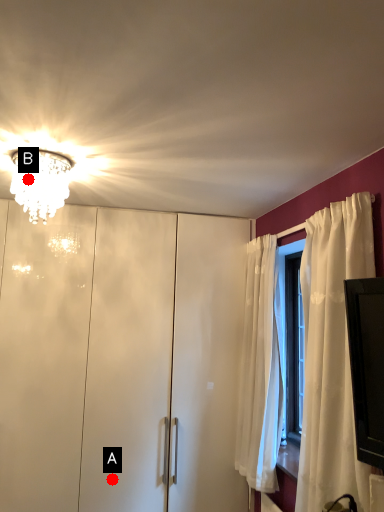
Question: Two points are circled on the image, labeled by A and B beside each circle. Which point is further to the camera?

Choices:
 (A) A is further
 (B) B is further

Answer: (A)